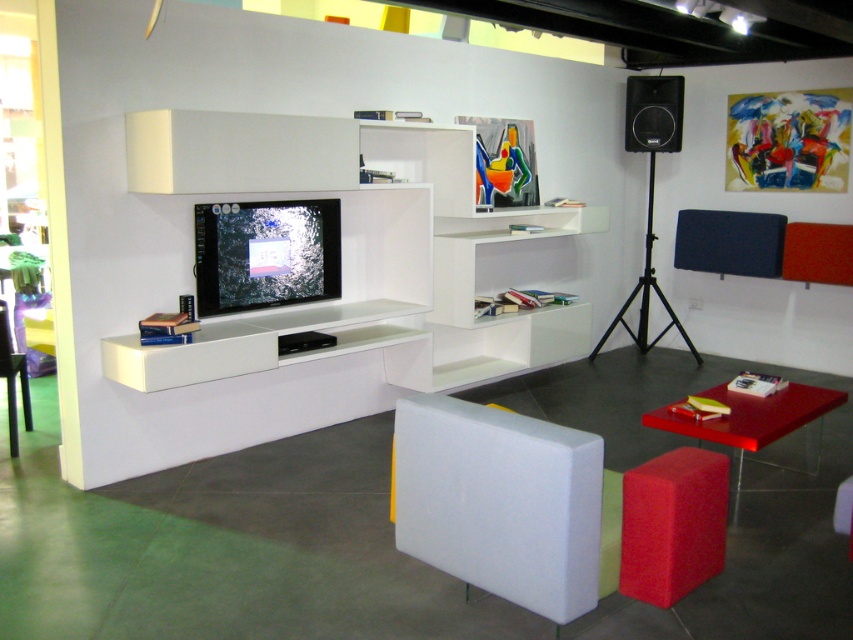
Question: Considering the real-world distances, which object is farthest from the matte red table at lower right?

Choices:
 (A) matte black chair at lower left
 (B) rubberized red stool at lower right
 (C) black matte speaker at upper right
 (D) white foam chair at center

Answer: (A)

Question: Does matte red table at lower right appear under matte black chair at lower left?

Choices:
 (A) no
 (B) yes

Answer: (B)

Question: Estimate the real-world distances between objects in this image. Which object is closer to the rubberized red stool at lower right?

Choices:
 (A) matte black chair at lower left
 (B) white foam chair at center
 (C) matte red table at lower right
 (D) black matte speaker at upper right

Answer: (B)

Question: Considering the real-world distances, which object is closest to the white foam chair at center?

Choices:
 (A) matte black chair at lower left
 (B) rubberized red stool at lower right
 (C) matte red table at lower right

Answer: (B)

Question: Does white foam chair at center have a smaller size compared to black matte speaker at upper right?

Choices:
 (A) no
 (B) yes

Answer: (A)

Question: Is rubberized red stool at lower right above matte red table at lower right?

Choices:
 (A) yes
 (B) no

Answer: (B)